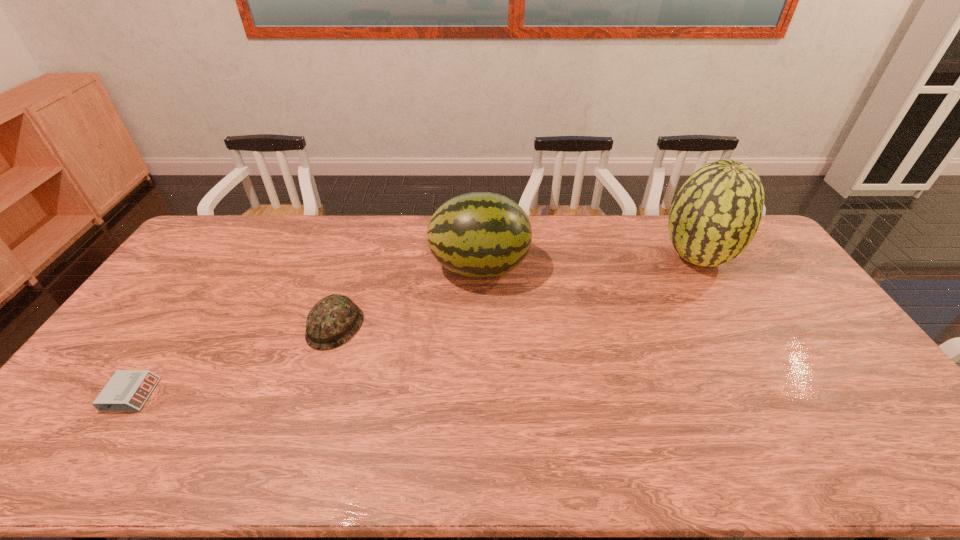
Locate which object is the closest to the alarm clock. Please provide its 2D coordinates. Your answer should be formatted as a tuple, i.e. [(x, y)], where the tuple contains the x and y coordinates of a point satisfying the conditions above.

[(332, 321)]

Locate an element on the screen. The width and height of the screenshot is (960, 540). vacant space that satisfies the following two spatial constraints: 1. on the back side of the taller watermelon; 2. on the left side of the third object from right to left is located at coordinates (357, 258).

Find the location of a particular element. The image size is (960, 540). free space in the image that satisfies the following two spatial constraints: 1. on the back side of the leftmost object; 2. on the right side of the right watermelon is located at coordinates (224, 258).